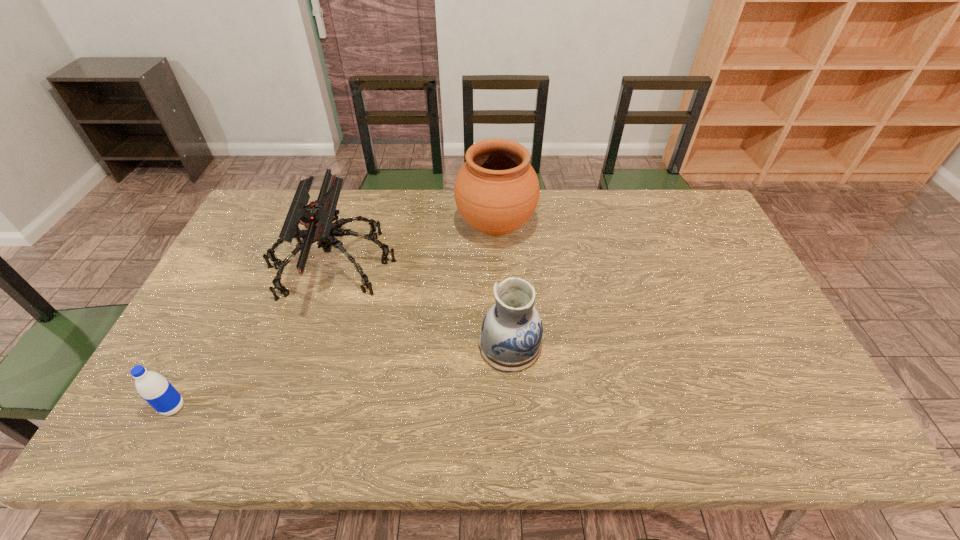
This screenshot has width=960, height=540. I want to click on blank region between the shorter pottery and the third object from right to left, so click(x=421, y=305).

What are the coordinates of `free space between the second object from left to right and the nearer pottery` in the screenshot? It's located at (421, 305).

Locate an element on the screen. vacant region between the drone and the water bottle is located at coordinates (253, 336).

Locate an element on the screen. This screenshot has height=540, width=960. vacant region between the drone and the leftmost object is located at coordinates (253, 336).

This screenshot has height=540, width=960. What are the coordinates of `free spot between the shortest object and the nearer pottery` in the screenshot? It's located at (342, 376).

You are a GUI agent. You are given a task and a screenshot of the screen. Output one action in this format:
    pyautogui.click(x=<x>, y=<y>)
    Task: Click on the free space between the leftmost object and the drone
    The image size is (960, 540).
    Given the screenshot: What is the action you would take?
    pyautogui.click(x=253, y=336)

Locate which object is the second closest to the farther pottery. Please provide its 2D coordinates. Your answer should be formatted as a tuple, i.e. [(x, y)], where the tuple contains the x and y coordinates of a point satisfying the conditions above.

[(510, 341)]

At what (x,y) coordinates should I click in order to perform the action: click on the third closest object to the farther pottery. Please return your answer as a coordinate pair (x, y). Image resolution: width=960 pixels, height=540 pixels. Looking at the image, I should click on (153, 387).

You are a GUI agent. You are given a task and a screenshot of the screen. Output one action in this format:
    pyautogui.click(x=<x>, y=<y>)
    Task: Click on the free space that satisfies the following two spatial constraints: 1. on the front side of the farther pottery; 2. on the right side of the shorter pottery
    The image size is (960, 540).
    Given the screenshot: What is the action you would take?
    pyautogui.click(x=500, y=345)

At what (x,y) coordinates should I click in order to perform the action: click on free spot that satisfies the following two spatial constraints: 1. on the back side of the drone; 2. on the left side of the water bottle. Please return your answer as a coordinate pair (x, y). The image size is (960, 540). Looking at the image, I should click on 248,265.